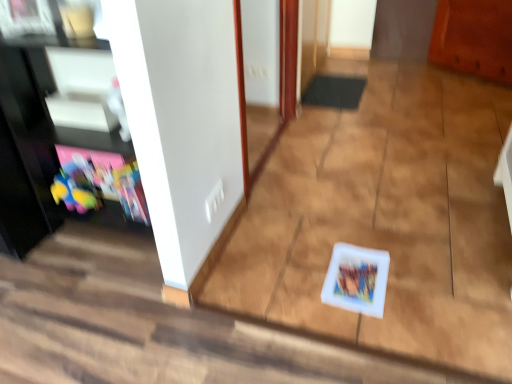
Question: From a real-world perspective, relative to white matte card game at center, is black glossy entertainment center at left vertically above or below?

Choices:
 (A) below
 (B) above

Answer: (B)

Question: Is black glossy entertainment center at left bigger or smaller than white matte card game at center?

Choices:
 (A) big
 (B) small

Answer: (A)

Question: Based on their relative distances, which object is nearer to the matt black shelf at left?

Choices:
 (A) white glossy door at center
 (B) white matte card game at center
 (C) black glossy entertainment center at left
 (D) black rubber doormat at center
 (E) wooden cabinet at upper right

Answer: (C)

Question: Which object is the farthest from the black glossy entertainment center at left?

Choices:
 (A) white matte card game at center
 (B) white plastic book at center
 (C) wooden cabinet at upper right
 (D) black rubber doormat at center
 (E) white glossy door at center

Answer: (C)